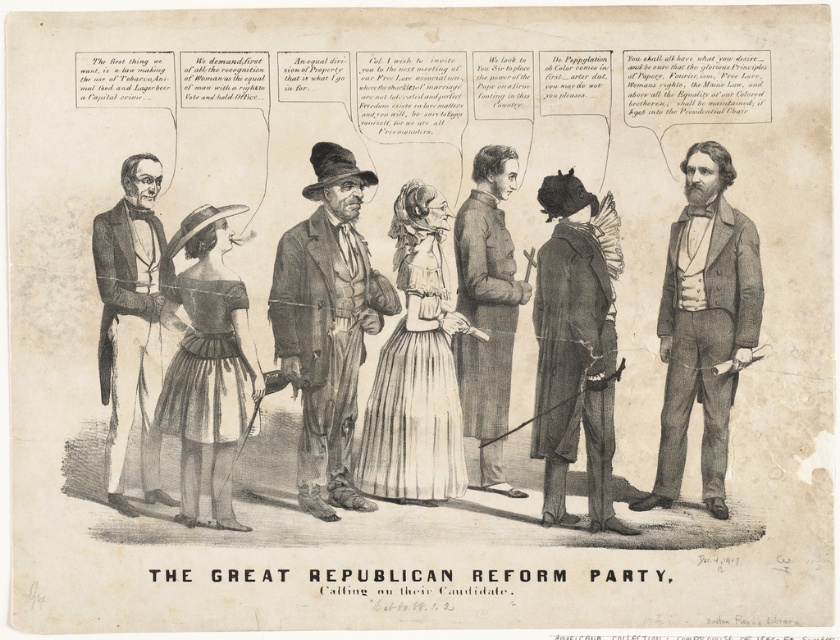
Is point (699, 260) positioned before point (571, 323)?

No, it is behind (571, 323).

What do you see at coordinates (704, 323) in the screenshot? The height and width of the screenshot is (640, 840). I see `smooth gray suit at right` at bounding box center [704, 323].

Does point (728, 385) lie behind point (584, 339)?

That is True.

Find the location of a particular element. The image size is (840, 640). smooth gray suit at right is located at coordinates (704, 323).

Who is positioned more to the left, matte brown dress at center-left or smooth brown coat at center?

Positioned to the left is matte brown dress at center-left.

Is matte brown dress at center-left closer to camera compared to smooth brown coat at center?

Yes, matte brown dress at center-left is in front of smooth brown coat at center.

Between point (208, 260) and point (471, 394), which one is positioned behind?

Positioned behind is point (471, 394).

Locate an element on the screen. matte brown dress at center-left is located at coordinates (207, 362).

Between point (607, 452) and point (193, 362), which one is positioned in front?

Point (193, 362) is more forward.

Is dark brown leather coat at center smaller than dark brown fabric dress at center?

No, dark brown leather coat at center is not smaller than dark brown fabric dress at center.

Where is `dark brown leather coat at center`? Image resolution: width=840 pixels, height=640 pixels. dark brown leather coat at center is located at coordinates (576, 348).